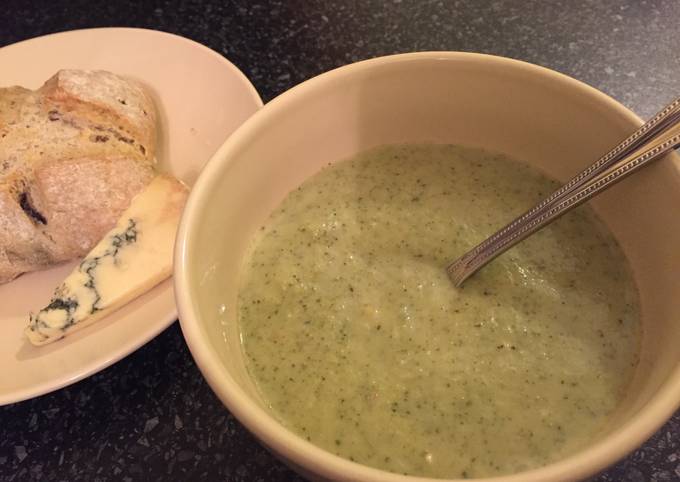
Find the location of `silver metallic spoon`. silver metallic spoon is located at coordinates (636, 153).